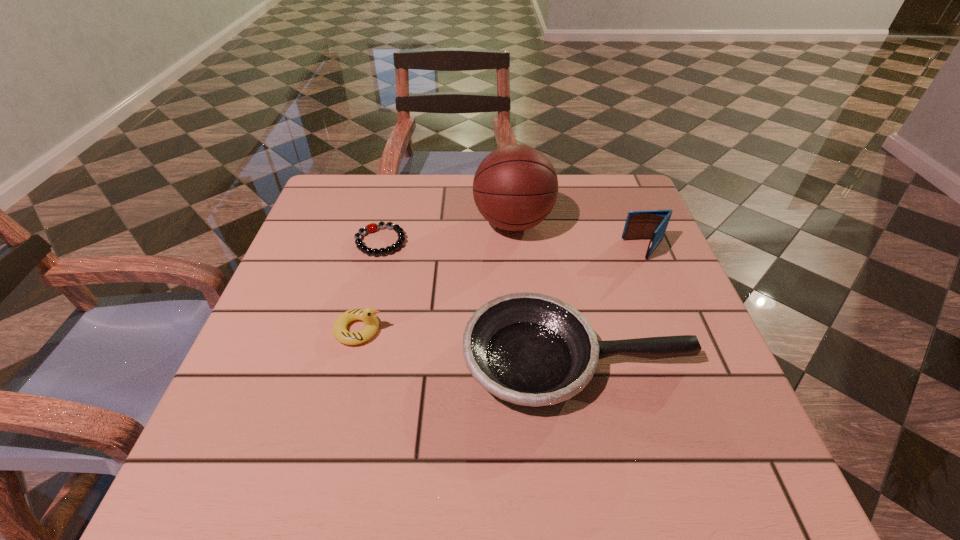
This screenshot has height=540, width=960. I want to click on vacant space located 0.110m on the right of the bracelet, so click(453, 241).

Locate an element on the screen. basketball that is at the far edge is located at coordinates (515, 187).

Locate an element on the screen. This screenshot has width=960, height=540. bracelet that is at the far edge is located at coordinates (372, 227).

You are a GUI agent. You are given a task and a screenshot of the screen. Output one action in this format:
    pyautogui.click(x=<x>, y=<y>)
    Task: Click on the duckling that is at the left edge
    The height and width of the screenshot is (540, 960).
    Given the screenshot: What is the action you would take?
    [367, 315]

Identify the location of bracelet at the left edge. Image resolution: width=960 pixels, height=540 pixels. (372, 227).

Find the location of a particular element. The height and width of the screenshot is (540, 960). wallet present at the right edge is located at coordinates (652, 224).

Find the location of a particular element. The width and height of the screenshot is (960, 540). frying pan located at the right edge is located at coordinates (531, 349).

Locate an element on the screen. The image size is (960, 540). object present at the far left corner is located at coordinates (372, 227).

Locate an element on the screen. free location at the far edge of the desktop is located at coordinates (471, 219).

Find the location of a particular element. Image resolution: width=960 pixels, height=540 pixels. free space at the near edge is located at coordinates (358, 481).